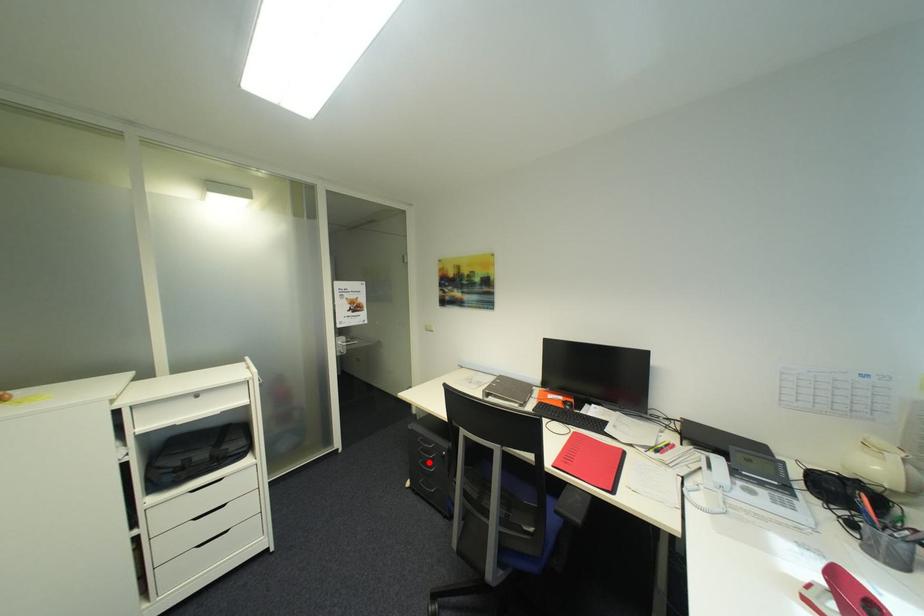
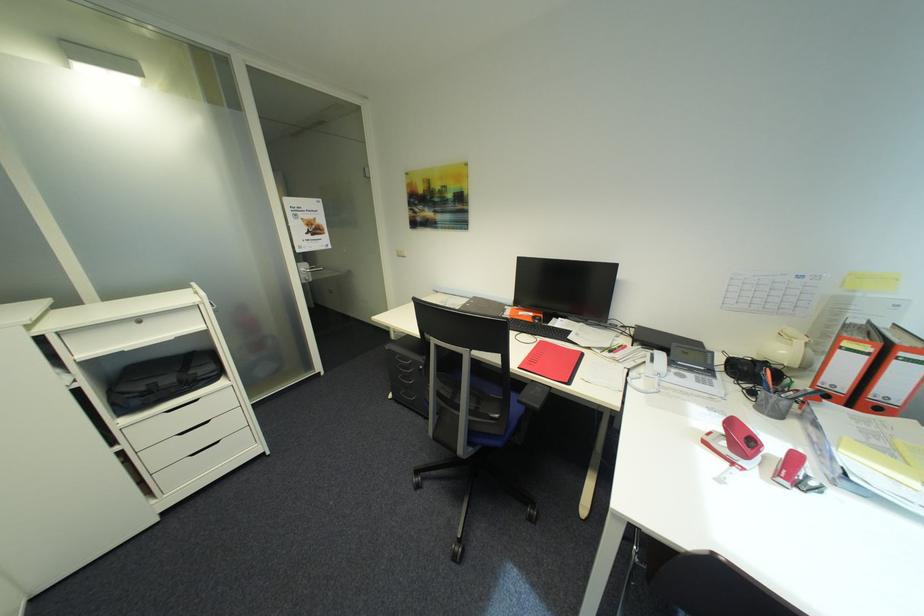
The point at the highlighted location is marked in the first image. Where is the corresponding point in the second image?

(408, 378)